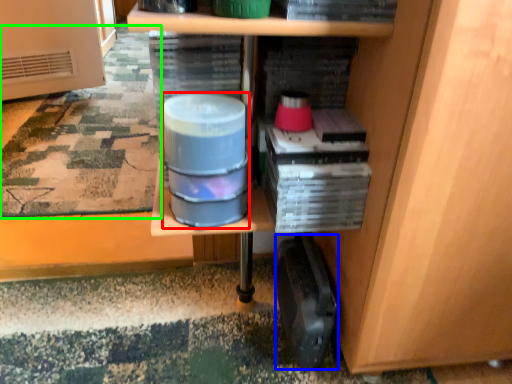
Question: Which object is the farthest from water (highlighted by a red box)? Choose among these: wide (highlighted by a blue box) or mat (highlighted by a green box).

Choices:
 (A) wide
 (B) mat

Answer: (B)